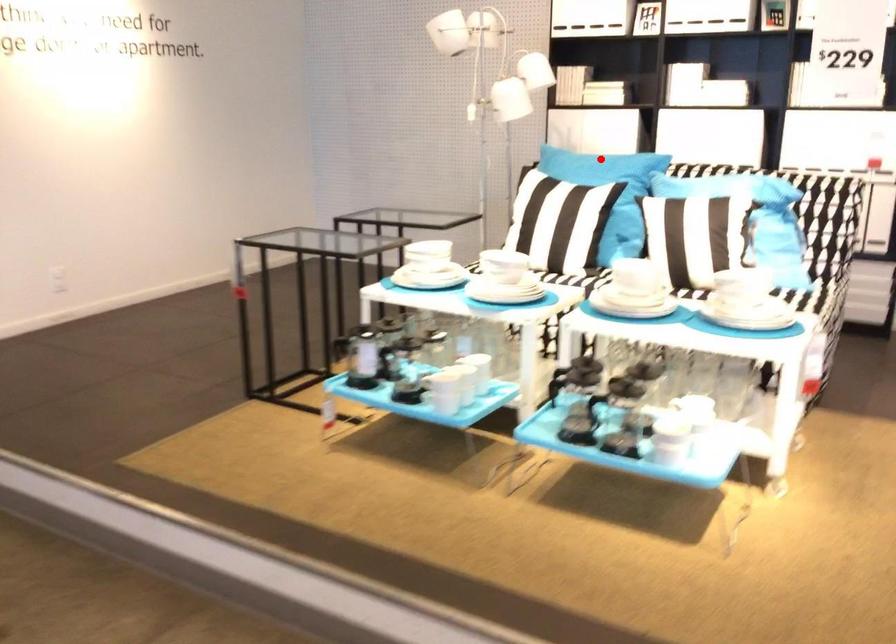
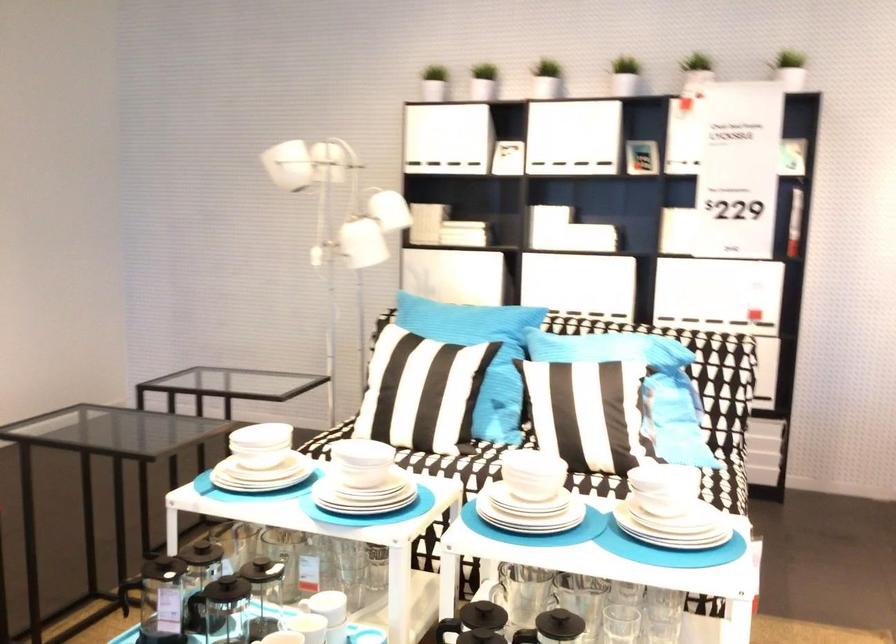
Question: I am providing you with two images of the same scene from different viewpoints. A red point is shown in image1. For the corresponding object point in image2, is it positioned nearer or farther from the camera?

Choices:
 (A) Nearer
 (B) Farther

Answer: (A)